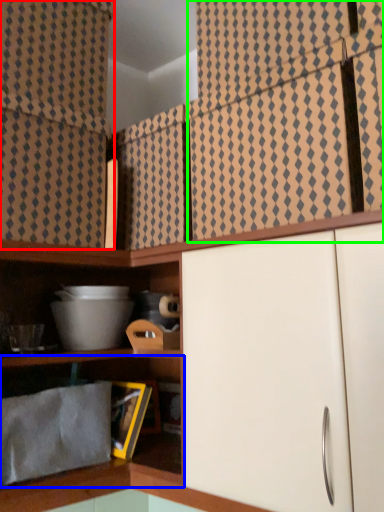
Question: Considering the real-world distances, which object is farthest from curtain (highlighted by a red box)? shelf (highlighted by a blue box) or curtain (highlighted by a green box)?

Choices:
 (A) shelf
 (B) curtain

Answer: (A)